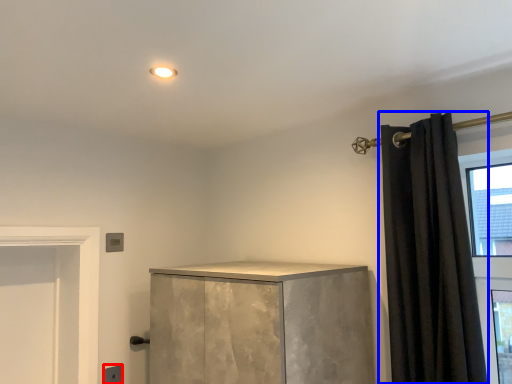
Question: Among these objects, which one is farthest to the camera, electric outlet (highlighted by a red box) or curtain (highlighted by a blue box)?

Choices:
 (A) electric outlet
 (B) curtain

Answer: (A)